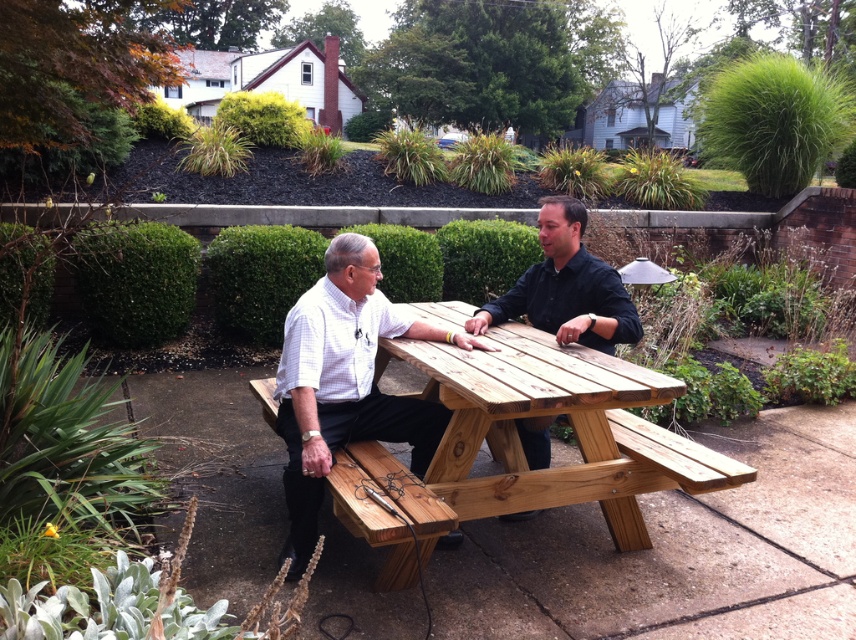
Between point (550, 276) and point (384, 524), which one is positioned behind?

Point (550, 276)

The height and width of the screenshot is (640, 856). In order to click on wooden picnic table at center in this screenshot , I will do `click(566, 288)`.

This screenshot has height=640, width=856. I want to click on wooden picnic table at center, so click(566, 288).

Between point (403, 308) and point (294, 561), which one is positioned behind?

The point (403, 308) is more distant.

Is natural wood picnic table at center bigger than light brown wood picnic table at center?

Yes.

Between point (514, 458) and point (290, 358), which one is positioned behind?

Point (514, 458)

The width and height of the screenshot is (856, 640). What are the coordinates of `natural wood picnic table at center` in the screenshot? It's located at (532, 413).

Between natural wood picnic table at center and natural wood park bench at center, which one has less height?

natural wood park bench at center is shorter.

What do you see at coordinates (532, 413) in the screenshot?
I see `natural wood picnic table at center` at bounding box center [532, 413].

I want to click on natural wood picnic table at center, so click(x=532, y=413).